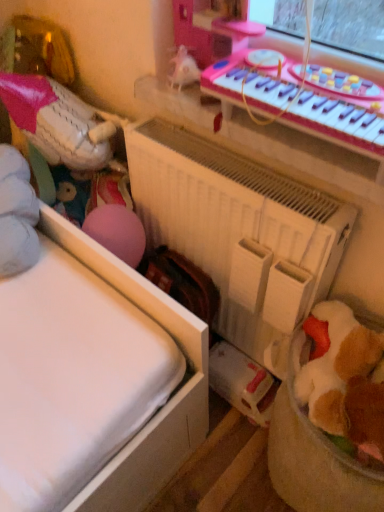
Question: From a real-world perspective, is white matte radiator at center positioned above or below white matte baseball glove at left, the first toy viewed from the left?

Choices:
 (A) above
 (B) below

Answer: (B)

Question: In terms of size, does white matte radiator at center appear bigger or smaller than white matte baseball glove at left, positioned as the second toy in right-to-left order?

Choices:
 (A) big
 (B) small

Answer: (A)

Question: Estimate the real-world distances between objects in this image. Which object is closer to the white matte radiator at center?

Choices:
 (A) white matte baseball glove at left, arranged as the second toy when viewed from the front
 (B) soft brown plush toy at lower right, marked as the second toy in a top-to-bottom arrangement
 (C) pink plastic musical keyboard at upper right

Answer: (B)

Question: Considering the real-world distances, which object is farthest from the white matte radiator at center?

Choices:
 (A) pink plastic musical keyboard at upper right
 (B) white matte baseball glove at left, arranged as the second toy when viewed from the front
 (C) soft brown plush toy at lower right, the first toy in the bottom-to-top sequence

Answer: (B)